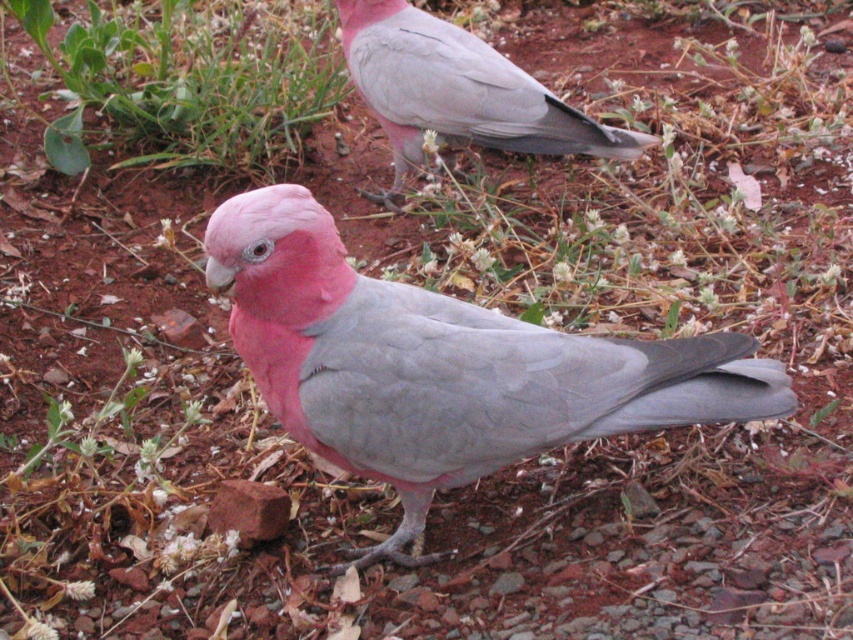
Question: In this image, where is matte pink parrot at center located relative to pink matte parrot at upper center?

Choices:
 (A) left
 (B) right

Answer: (A)

Question: Which of the following is the closest to the observer?

Choices:
 (A) (378, 12)
 (B) (143, 35)

Answer: (A)

Question: Considering the real-world distances, which object is farthest from the green leafy grass at upper left?

Choices:
 (A) pink matte parrot at upper center
 (B) matte pink parrot at center

Answer: (B)

Question: Does matte pink parrot at center have a smaller size compared to green leafy grass at upper left?

Choices:
 (A) yes
 (B) no

Answer: (A)

Question: Among these points, which one is farthest from the camera?

Choices:
 (A) (248, 125)
 (B) (358, 280)

Answer: (A)

Question: Does matte pink parrot at center have a lesser width compared to green leafy grass at upper left?

Choices:
 (A) no
 (B) yes

Answer: (B)